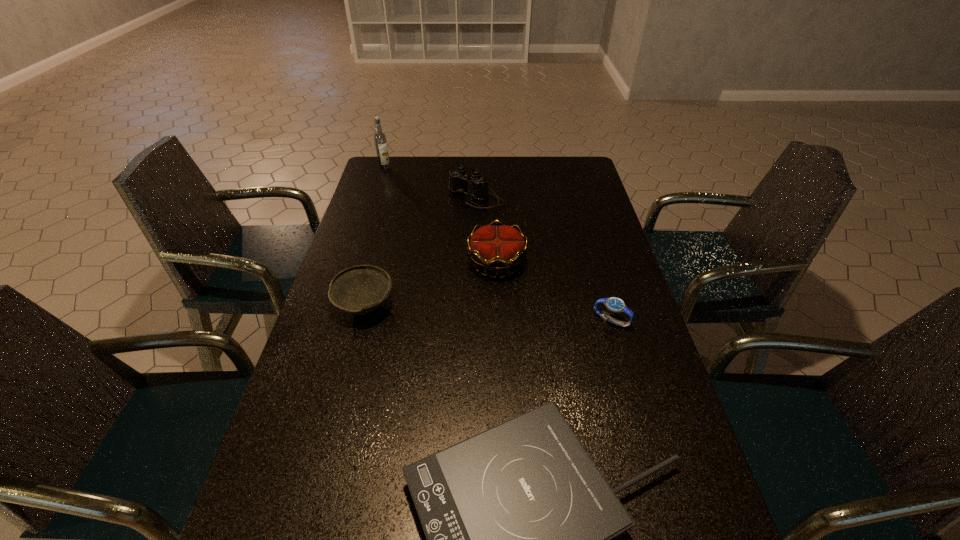
What are the coordinates of `vacant space at the far left corner of the desktop` in the screenshot? It's located at (412, 170).

Where is `free space at the far right corner`? free space at the far right corner is located at coordinates (579, 165).

This screenshot has height=540, width=960. I want to click on vacant space that is in between the watch and the fifth nearest object, so click(x=543, y=260).

Locate an element on the screen. This screenshot has height=540, width=960. free space between the farthest object and the fourth nearest object is located at coordinates (441, 215).

The width and height of the screenshot is (960, 540). I want to click on vacant space that's between the fourth tallest object and the tallest object, so click(x=375, y=237).

Find the location of a particular element. This screenshot has height=540, width=960. empty location between the fifth nearest object and the tallest object is located at coordinates (430, 183).

Where is `free space between the binoculars and the farthest object`? free space between the binoculars and the farthest object is located at coordinates (430, 183).

This screenshot has height=540, width=960. I want to click on unoccupied area between the third shortest object and the crown, so click(x=431, y=284).

What are the coordinates of `empty location between the tallest object and the third farthest object` in the screenshot? It's located at (x=441, y=215).

Image resolution: width=960 pixels, height=540 pixels. What are the coordinates of `empty location between the third farthest object and the farthest object` in the screenshot? It's located at (441, 215).